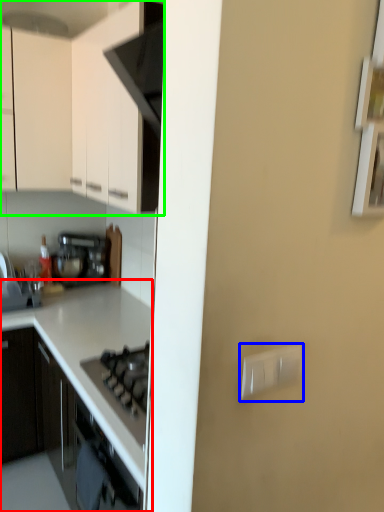
Question: Considering the real-world distances, which object is farthest from countertop (highlighted by a red box)? electric outlet (highlighted by a blue box) or cabinetry (highlighted by a green box)?

Choices:
 (A) electric outlet
 (B) cabinetry

Answer: (A)